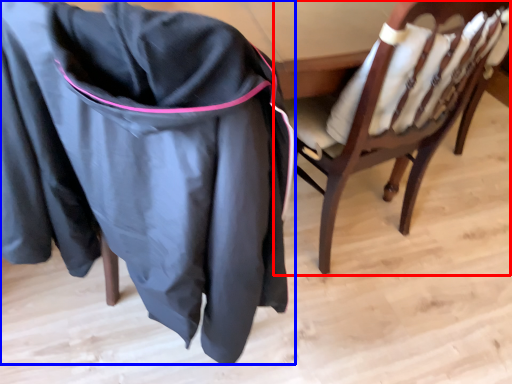
Question: Which of the following is the farthest to the observer, chair (highlighted by a red box) or clothing (highlighted by a blue box)?

Choices:
 (A) chair
 (B) clothing

Answer: (A)